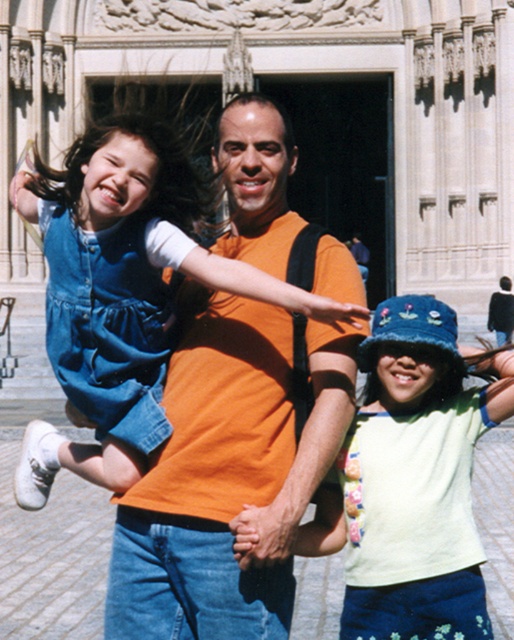
You are standing at the point marked as point (378, 410) in the image. The distance from this point to the viewer is 144.35 feet. If you want to take a closer photo of the historic building, should you move towards or away from the building?

Since the point (378, 410) is 144.35 feet away from the viewer, moving towards the building would decrease the distance, allowing for a closer photo.

You are standing at the point labeled point (324, 317) and want to move to the point labeled point (315, 544). Which direction should you move in to reach your destination?

You should move to the right to reach point (315, 544) from point (324, 317) because the x coordinate of the destination point is higher than the starting point.